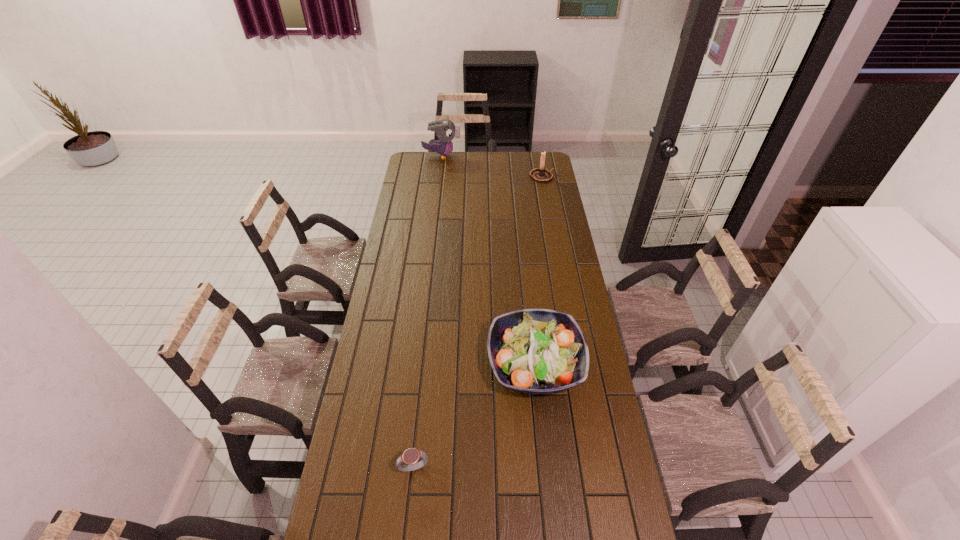
Find the location of `the tallest object`. the tallest object is located at coordinates point(446,130).

You are a GUI agent. You are given a task and a screenshot of the screen. Output one action in this format:
    pyautogui.click(x=<x>, y=<y>)
    Task: Click on the farthest object
    This screenshot has width=960, height=540.
    Given the screenshot: What is the action you would take?
    pyautogui.click(x=446, y=130)

Identify the location of the second tallest object. This screenshot has height=540, width=960. (541, 174).

You are a GUI agent. You are given a task and a screenshot of the screen. Output one action in this format:
    pyautogui.click(x=<x>, y=<y>)
    Task: Click on the third nearest object
    Image resolution: width=960 pixels, height=540 pixels.
    Given the screenshot: What is the action you would take?
    [x=541, y=174]

Where is `the second shortest object`? The height and width of the screenshot is (540, 960). the second shortest object is located at coordinates (538, 351).

The width and height of the screenshot is (960, 540). Find the location of `the second nearest object`. the second nearest object is located at coordinates (538, 351).

Where is `watch`? The width and height of the screenshot is (960, 540). watch is located at coordinates (410, 456).

You are a GUI agent. You are given a task and a screenshot of the screen. Output one action in this format:
    pyautogui.click(x=<x>, y=<y>)
    Task: Click on the shortest object
    Image resolution: width=960 pixels, height=540 pixels.
    Given the screenshot: What is the action you would take?
    pyautogui.click(x=410, y=456)

The image size is (960, 540). Find the location of `vacant area located 0.240m at the beak of the tallest object`. vacant area located 0.240m at the beak of the tallest object is located at coordinates (500, 156).

Locate an element on the screen. free space located 0.230m on the left of the second farthest object is located at coordinates (490, 176).